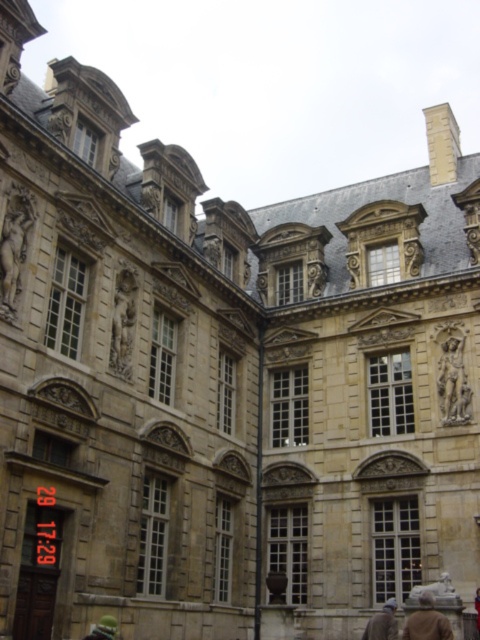
Which is below, brown woolen hat at lower right or bronze statue at upper center?

brown woolen hat at lower right is below.

Is brown woolen hat at lower right positioned before bronze statue at upper center?

Yes.

Does point (384, 621) come in front of point (316, 269)?

Yes, point (384, 621) is closer to viewer.

At what (x,y) coordinates should I click in order to perform the action: click on brown woolen hat at lower right. Please return your answer as a coordinate pair (x, y). Image resolution: width=480 pixels, height=640 pixels. Looking at the image, I should click on (383, 621).

Who is higher up, stone statue at left or brown leather jacket at lower right?

stone statue at left

Identify the location of stone statue at left. (13, 244).

Is polished bronze statue at center thinner than green fabric person at lower center?

Incorrect, polished bronze statue at center's width is not less than green fabric person at lower center's.

Does polished bronze statue at center have a lesser height compared to green fabric person at lower center?

Incorrect, polished bronze statue at center's height does not fall short of green fabric person at lower center's.

Describe the element at coordinates (122, 323) in the screenshot. This screenshot has width=480, height=640. I see `polished bronze statue at center` at that location.

This screenshot has width=480, height=640. I want to click on polished bronze statue at center, so click(x=122, y=323).